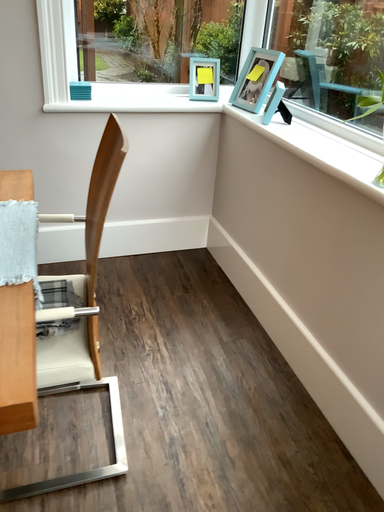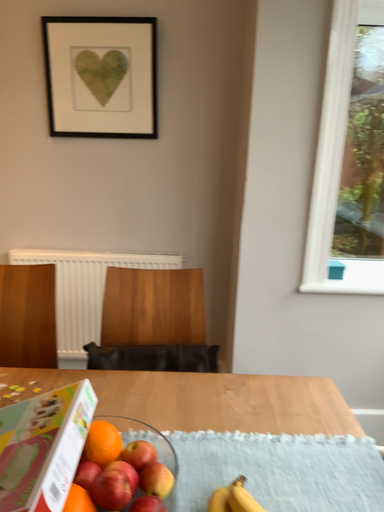
Question: How did the camera likely rotate when shooting the video?

Choices:
 (A) rotated right
 (B) rotated left

Answer: (B)